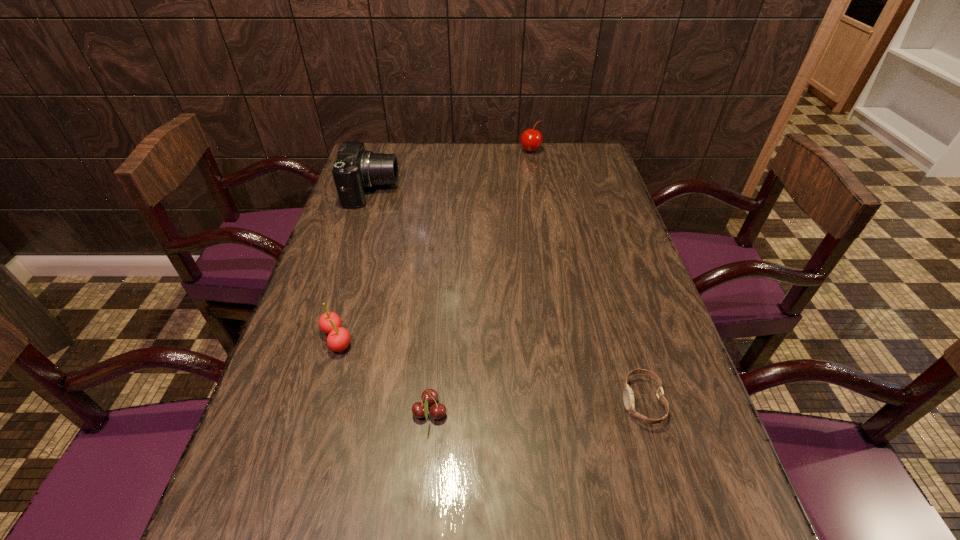
Where is `vacant point located between the leftmost cherry and the second farthest object`? This screenshot has height=540, width=960. vacant point located between the leftmost cherry and the second farthest object is located at coordinates (354, 265).

Where is `vacant point located between the rightmost cherry and the watch`? Image resolution: width=960 pixels, height=540 pixels. vacant point located between the rightmost cherry and the watch is located at coordinates (587, 276).

Locate an element on the screen. free point between the third object from left to right and the rightmost object is located at coordinates (536, 407).

Where is `blank region between the shortest object and the rightmost cherry`? Image resolution: width=960 pixels, height=540 pixels. blank region between the shortest object and the rightmost cherry is located at coordinates (587, 276).

The image size is (960, 540). In order to click on free area in between the second cherry from left to right and the fourth nearest object in this screenshot , I will do `click(400, 302)`.

In order to click on free space between the second farthest cherry and the farthest object in this screenshot , I will do `click(434, 245)`.

Identify which object is the third nearest to the second object from right to left. Please provide its 2D coordinates. Your answer should be formatted as a tuple, i.e. [(x, y)], where the tuple contains the x and y coordinates of a point satisfying the conditions above.

[(628, 397)]

Identify which object is the fourth closest to the farthest cherry. Please provide its 2D coordinates. Your answer should be formatted as a tuple, i.e. [(x, y)], where the tuple contains the x and y coordinates of a point satisfying the conditions above.

[(429, 396)]

I want to click on cherry identified as the third closest to the tallest object, so click(429, 396).

Where is `the second closest cherry to the farthest cherry`? The height and width of the screenshot is (540, 960). the second closest cherry to the farthest cherry is located at coordinates (429, 396).